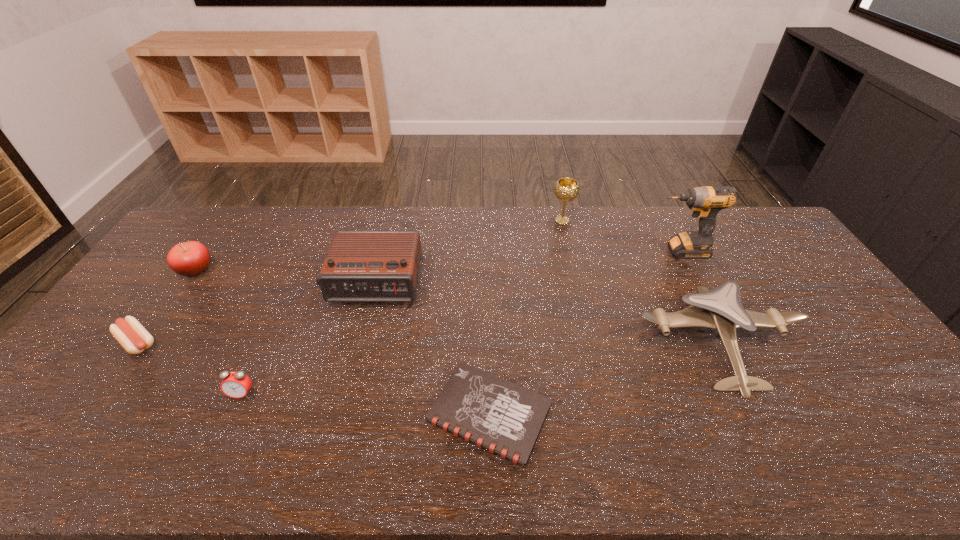
The width and height of the screenshot is (960, 540). What are the coordinates of `vacant space situated 0.290m on the left of the notebook` in the screenshot? It's located at (308, 414).

I want to click on drill located in the far edge section of the desktop, so click(706, 202).

The image size is (960, 540). Find the location of `chalice located in the far edge section of the desktop`. chalice located in the far edge section of the desktop is located at coordinates (566, 189).

This screenshot has height=540, width=960. Find the location of `object located in the near edge section of the desktop`. object located in the near edge section of the desktop is located at coordinates (502, 417).

You are a GUI agent. You are given a task and a screenshot of the screen. Output one action in this format:
    pyautogui.click(x=<x>, y=<y>)
    Task: Click on the apple located at the left edge
    
    Given the screenshot: What is the action you would take?
    pyautogui.click(x=191, y=258)

Where is `sausage present at the left edge`? sausage present at the left edge is located at coordinates (133, 337).

Where is `vacant space at the far edge`? vacant space at the far edge is located at coordinates (540, 240).

Locate an element on the screen. The width and height of the screenshot is (960, 540). vacant region at the left edge of the desktop is located at coordinates [42, 422].

Where is `vacant area at the right edge`? This screenshot has height=540, width=960. vacant area at the right edge is located at coordinates (823, 333).

At what (x,y) coordinates should I click in order to perform the action: click on free space that is in between the apple and the drone. Please return your answer as a coordinate pair (x, y). Looking at the image, I should click on (457, 306).